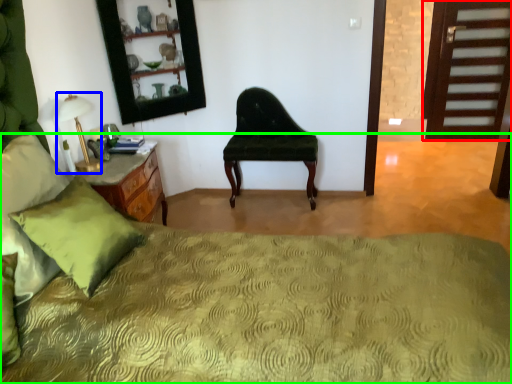
Question: Considering the real-world distances, which object is farthest from door (highlighted by a red box)? table lamp (highlighted by a blue box) or bed (highlighted by a green box)?

Choices:
 (A) table lamp
 (B) bed

Answer: (A)